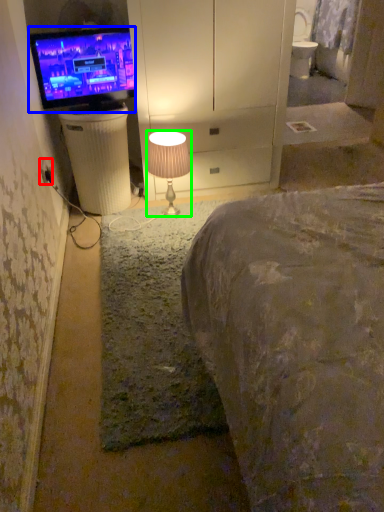
Question: Based on their relative distances, which object is nearer to electric outlet (highlighted by a red box)? Choose from television (highlighted by a blue box) and lamp (highlighted by a green box).

Choices:
 (A) television
 (B) lamp

Answer: (A)